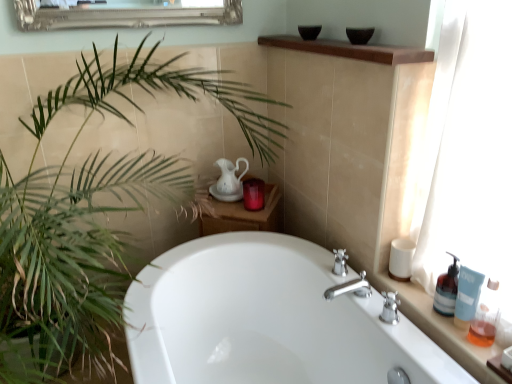
Question: Should I look upward or downward to see translucent glass soap dispenser at right, the first soap dispenser positioned from the back?

Choices:
 (A) up
 (B) down

Answer: (B)

Question: From a real-world perspective, is translucent plastic bottles at right, acting as the second counter top starting from the top, over green leafy plant at left?

Choices:
 (A) no
 (B) yes

Answer: (A)

Question: Is translucent plastic bottles at right, the second counter top in the left-to-right sequence, further to the viewer compared to green leafy plant at left?

Choices:
 (A) no
 (B) yes

Answer: (B)

Question: Does translucent plastic bottles at right, marked as the first counter top in a bottom-to-top arrangement, have a lesser width compared to green leafy plant at left?

Choices:
 (A) yes
 (B) no

Answer: (A)

Question: Is translucent plastic bottles at right, acting as the second counter top starting from the top, wider than green leafy plant at left?

Choices:
 (A) yes
 (B) no

Answer: (B)

Question: Is translucent plastic bottles at right, the second counter top in the left-to-right sequence, bigger than green leafy plant at left?

Choices:
 (A) yes
 (B) no

Answer: (B)

Question: Is translucent plastic bottles at right, acting as the second counter top starting from the top, in front of green leafy plant at left?

Choices:
 (A) yes
 (B) no

Answer: (B)

Question: From a real-world perspective, is brown wood shelf at upper center, the second counter top in the bottom-to-top sequence, over translucent plastic bottles at right, marked as the first counter top in a bottom-to-top arrangement?

Choices:
 (A) yes
 (B) no

Answer: (A)

Question: Is brown wood shelf at upper center, the 1th counter top in the left-to-right sequence, positioned with its back to translucent plastic bottles at right, marked as the first counter top in a bottom-to-top arrangement?

Choices:
 (A) yes
 (B) no

Answer: (B)

Question: From a real-world perspective, is brown wood shelf at upper center, acting as the second counter top starting from the right, under translucent plastic bottles at right, acting as the second counter top starting from the top?

Choices:
 (A) yes
 (B) no

Answer: (B)

Question: Is brown wood shelf at upper center, the second counter top in the bottom-to-top sequence, positioned before translucent plastic bottles at right, acting as the second counter top starting from the top?

Choices:
 (A) yes
 (B) no

Answer: (B)

Question: Considering the relative sizes of brown wood shelf at upper center, acting as the second counter top starting from the right, and translucent plastic bottles at right, which is the first counter top from right to left, in the image provided, is brown wood shelf at upper center, acting as the second counter top starting from the right, shorter than translucent plastic bottles at right, which is the first counter top from right to left,?

Choices:
 (A) no
 (B) yes

Answer: (A)

Question: Does brown wood shelf at upper center, the 1th counter top in the left-to-right sequence, have a larger size compared to translucent plastic bottles at right, the second counter top in the left-to-right sequence?

Choices:
 (A) yes
 (B) no

Answer: (A)

Question: Is white matte cup at right, arranged as the 2th toiletry when viewed from the top, oriented towards translucent glass soap dispenser at right, the second soap dispenser positioned from the front?

Choices:
 (A) no
 (B) yes

Answer: (A)